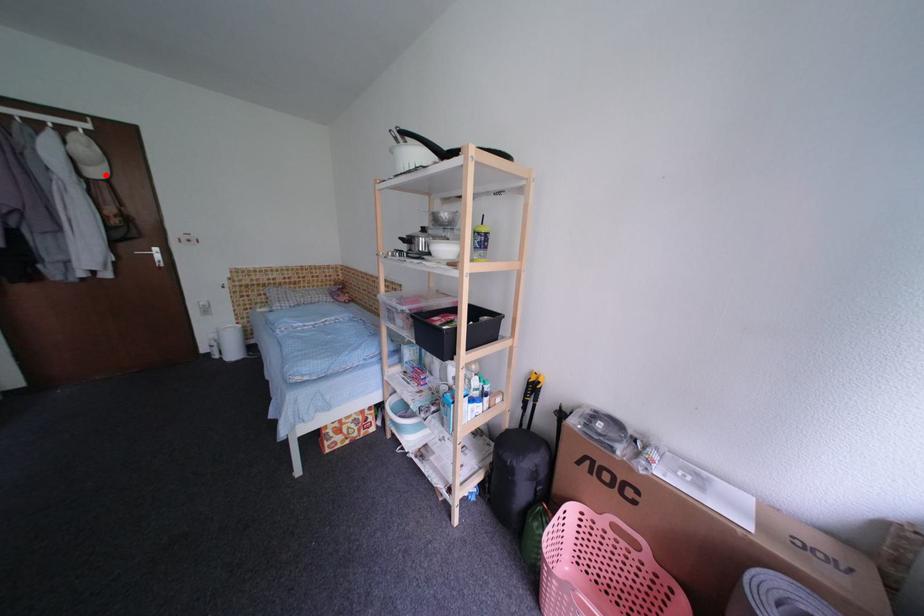
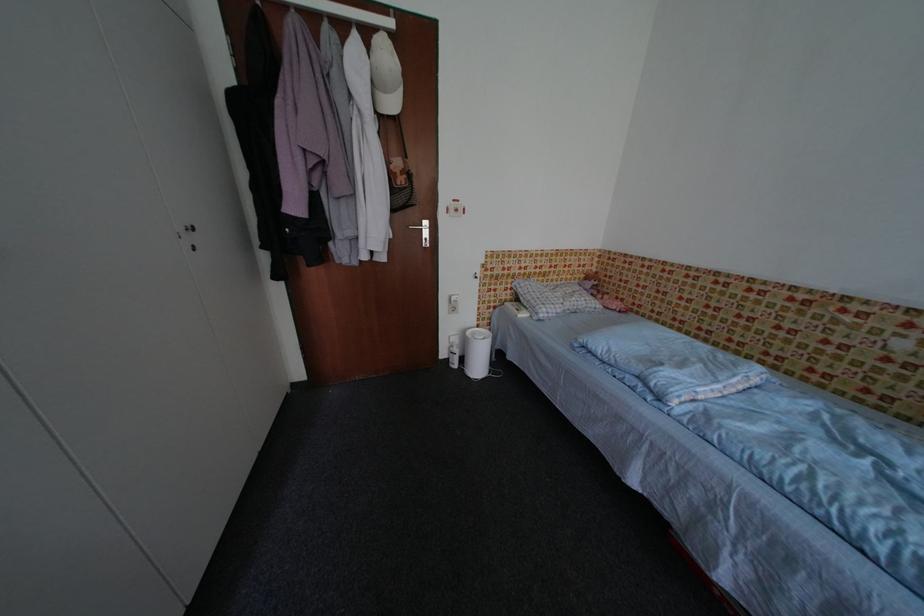
Question: A red point is marked in image1. In image2, is the corresponding 3D point closer to the camera or farther? Reply with the corresponding letter.

Choices:
 (A) The corresponding 3D point is closer.
 (B) The corresponding 3D point is farther.

Answer: (A)